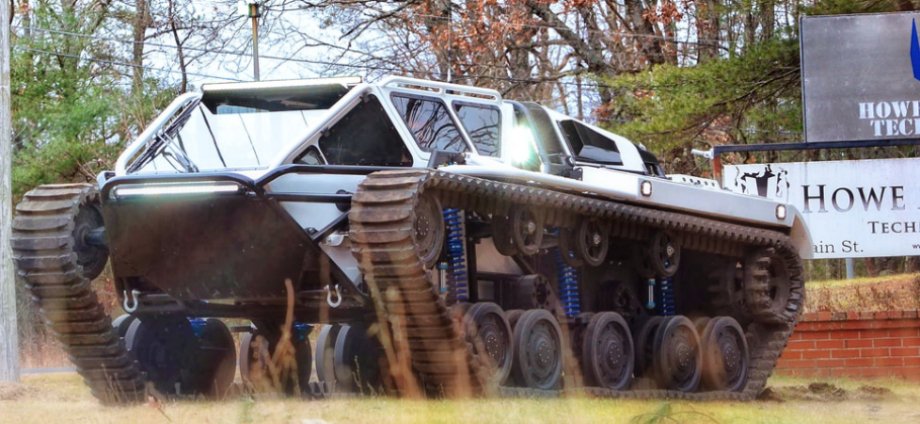
This screenshot has width=920, height=424. Identify the location of windows. (248, 119), (362, 142), (433, 133), (484, 119), (605, 147).